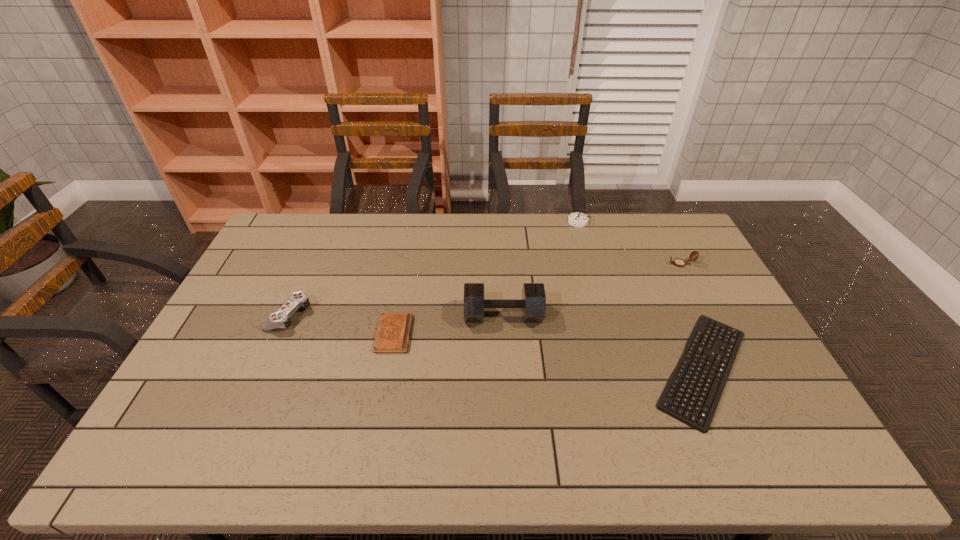
Identify the location of free space that is in between the fourth object from right to left and the fifth object from right to left. (448, 325).

Where is `empty location between the right compass and the computer keyboard`? empty location between the right compass and the computer keyboard is located at coordinates (692, 316).

The image size is (960, 540). What are the coordinates of `vacant space that's between the nearer compass and the tallest object` in the screenshot? It's located at (592, 289).

The width and height of the screenshot is (960, 540). What are the coordinates of `unoccupied area between the computer keyboard and the nearer compass` in the screenshot? It's located at coord(692,316).

Locate an element on the screen. The height and width of the screenshot is (540, 960). vacant space in between the computer keyboard and the third object from right to left is located at coordinates (640, 295).

Locate an element on the screen. The height and width of the screenshot is (540, 960). vacant space in between the nearer compass and the farther compass is located at coordinates (630, 243).

Find the location of a particular element. free space between the control and the computer keyboard is located at coordinates (496, 342).

Where is `the closest object to the leftmost object`? the closest object to the leftmost object is located at coordinates (393, 334).

This screenshot has height=540, width=960. Find the location of `the fifth closest object relative to the computer keyboard`. the fifth closest object relative to the computer keyboard is located at coordinates (279, 319).

This screenshot has height=540, width=960. Identify the location of free space that satisfies the following two spatial constraints: 1. on the spine side of the computer keyboard; 2. on the left side of the second object from left to right. (388, 368).